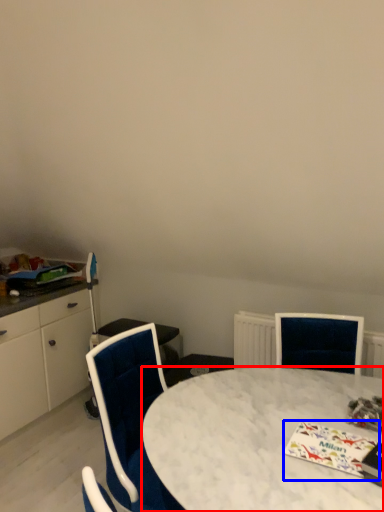
Question: Which object is further to the camera taking this photo, desk (highlighted by a red box) or magazine (highlighted by a blue box)?

Choices:
 (A) desk
 (B) magazine

Answer: (B)